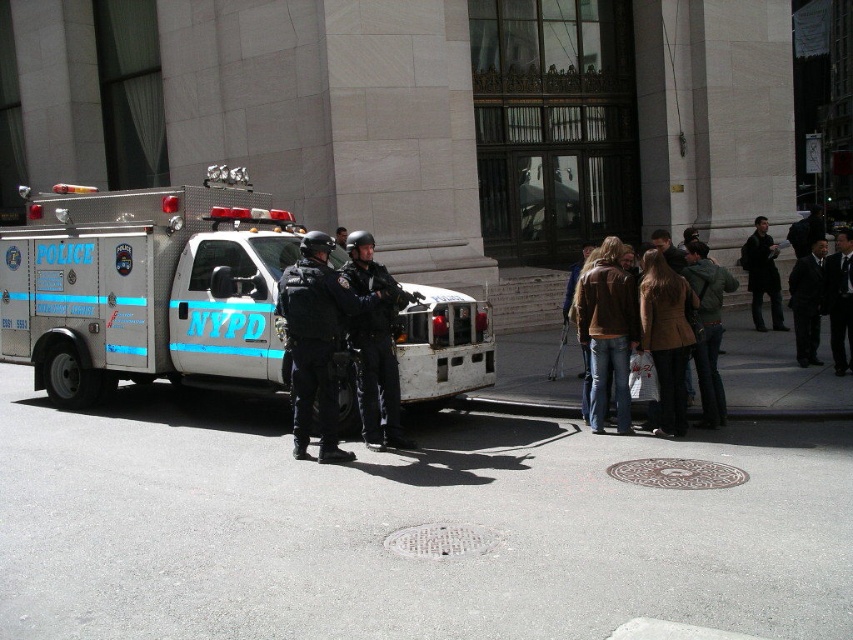
Question: Which object is closer to the camera taking this photo?

Choices:
 (A) silver metallic police vehicle at center
 (B) dark brown leather jacket at right
 (C) brown leather jacket at center

Answer: (C)

Question: Can you confirm if black smooth suit at right is wider than dark brown leather jacket at right?

Choices:
 (A) no
 (B) yes

Answer: (A)

Question: Does black uniformed police at center have a larger size compared to black smooth suit at right?

Choices:
 (A) yes
 (B) no

Answer: (A)

Question: Which point is farther from the camera taking this photo?

Choices:
 (A) (401, 438)
 (B) (817, 301)
 (C) (654, 289)

Answer: (B)

Question: Is green fabric jacket at center below black smooth suit at right?

Choices:
 (A) yes
 (B) no

Answer: (A)

Question: Based on their relative distances, which object is nearer to the dark brown leather jacket at right?

Choices:
 (A) brown leather jacket at center
 (B) silver metallic police vehicle at center

Answer: (A)